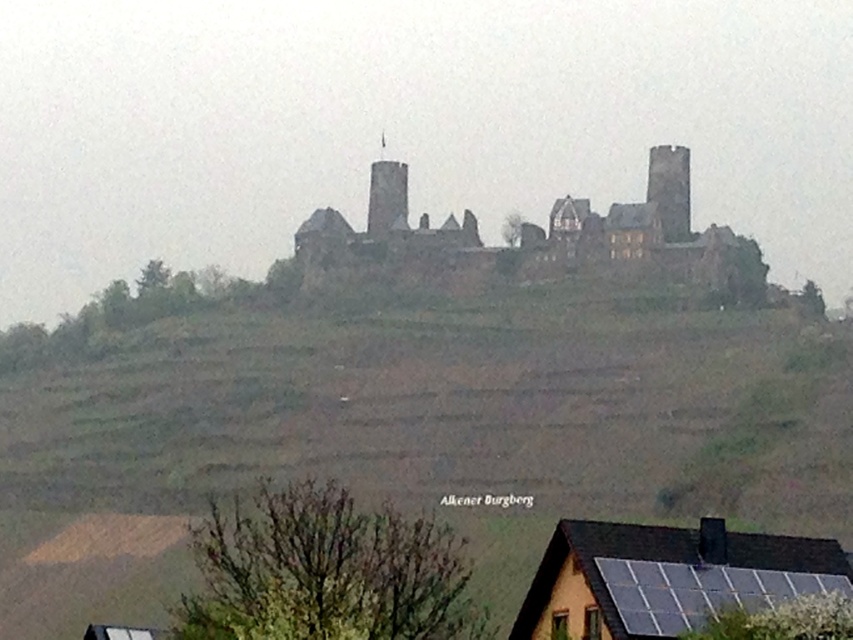
Question: Which object is positioned closest to the brown stone castle at center?

Choices:
 (A) green grassy hillside at upper center
 (B) black solar panels at lower right

Answer: (A)

Question: Is green grassy hillside at upper center positioned at the back of black solar panels at lower right?

Choices:
 (A) yes
 (B) no

Answer: (A)

Question: Which of the following is the closest to the observer?

Choices:
 (A) (422, 400)
 (B) (805, 541)
 (C) (685, 257)

Answer: (B)

Question: Can you confirm if green grassy hillside at upper center is wider than black solar panels at lower right?

Choices:
 (A) no
 (B) yes

Answer: (B)

Question: Which point is farther from the camera taking this photo?

Choices:
 (A) (762, 352)
 (B) (612, 522)
 (C) (734, 282)

Answer: (C)

Question: Is green grassy hillside at upper center positioned behind black solar panels at lower right?

Choices:
 (A) yes
 (B) no

Answer: (A)